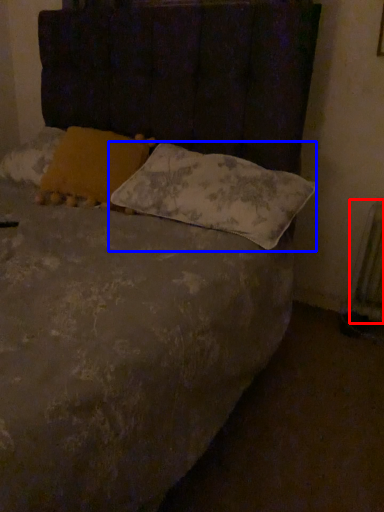
Question: Which point is closer to the camera, radiator (highlighted by a red box) or pillow (highlighted by a blue box)?

Choices:
 (A) radiator
 (B) pillow

Answer: (B)